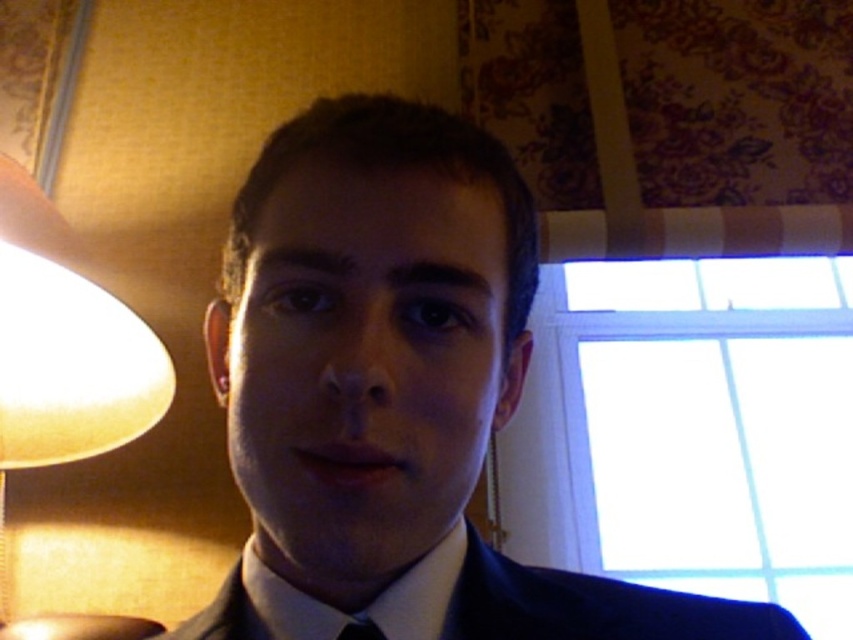
You are a photographer setting up a shoot in this room. You need to place a new camera stand between the matte black suit at center and the matte beige lampshade at left. Based on their positions, which object should the camera stand be closer to?

The matte black suit at center is positioned on the right side of the matte beige lampshade at left, so the camera stand should be placed closer to the matte beige lampshade at left since it is to the left of the suit.

You are a fashion designer observing the image and want to ensure proper placement of accessories. Which object is positioned lower in the scene between the navy blue fabric business suit at center and the black satin tie at lower center?

The navy blue fabric business suit at center is located below the black satin tie at lower center, so it is positioned lower in the scene.